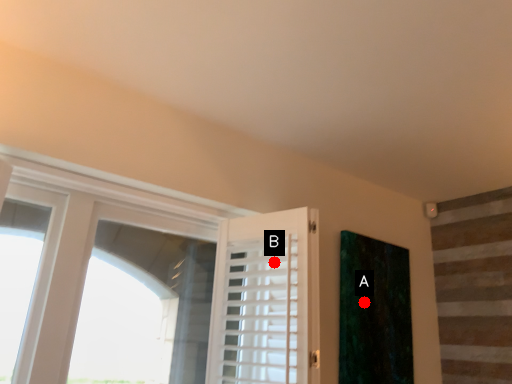
Question: Two points are circled on the image, labeled by A and B beside each circle. Which point is closer to the camera?

Choices:
 (A) A is closer
 (B) B is closer

Answer: (B)